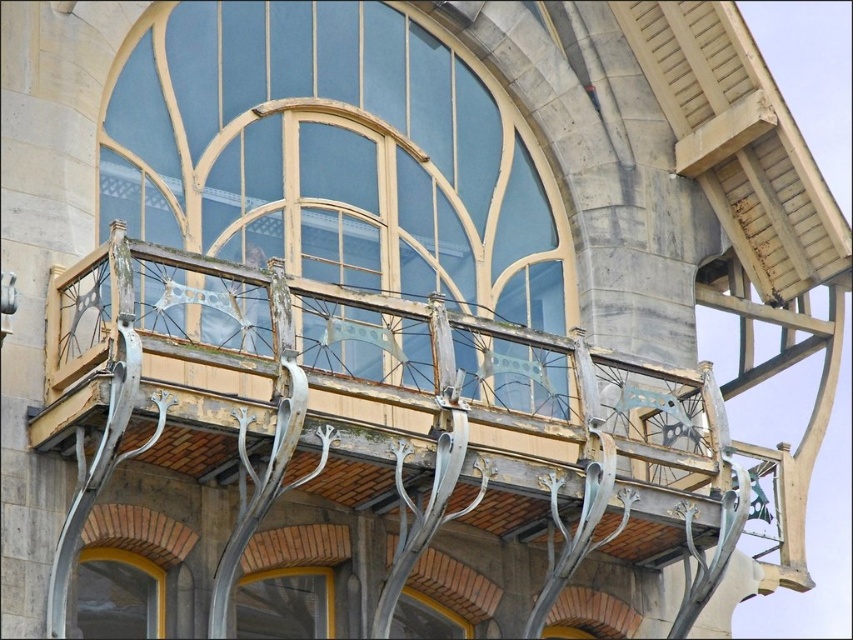
Question: Among these objects, which one is nearest to the camera?

Choices:
 (A) matte glass window at lower left
 (B) metallic silver balcony at center
 (C) matte glass window at center
 (D) matte glass window at lower center

Answer: (B)

Question: Which object is the closest to the matte glass window at center?

Choices:
 (A) matte glass window at lower center
 (B) matte glass window at lower left

Answer: (A)

Question: Based on their relative distances, which object is nearer to the matte glass window at lower center?

Choices:
 (A) matte glass window at lower left
 (B) matte glass window at center
 (C) metallic silver balcony at center

Answer: (A)

Question: Is matte glass window at center to the right of matte glass window at lower center from the viewer's perspective?

Choices:
 (A) yes
 (B) no

Answer: (A)

Question: Does matte glass window at lower left have a larger size compared to matte glass window at lower center?

Choices:
 (A) yes
 (B) no

Answer: (B)

Question: In this image, where is metallic silver balcony at center located relative to matte glass window at lower center?

Choices:
 (A) right
 (B) left

Answer: (A)